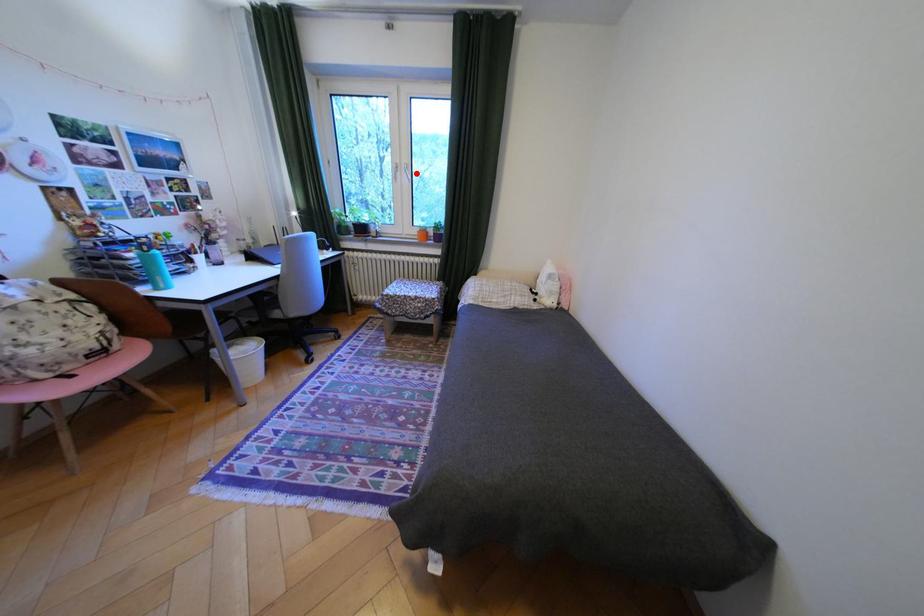
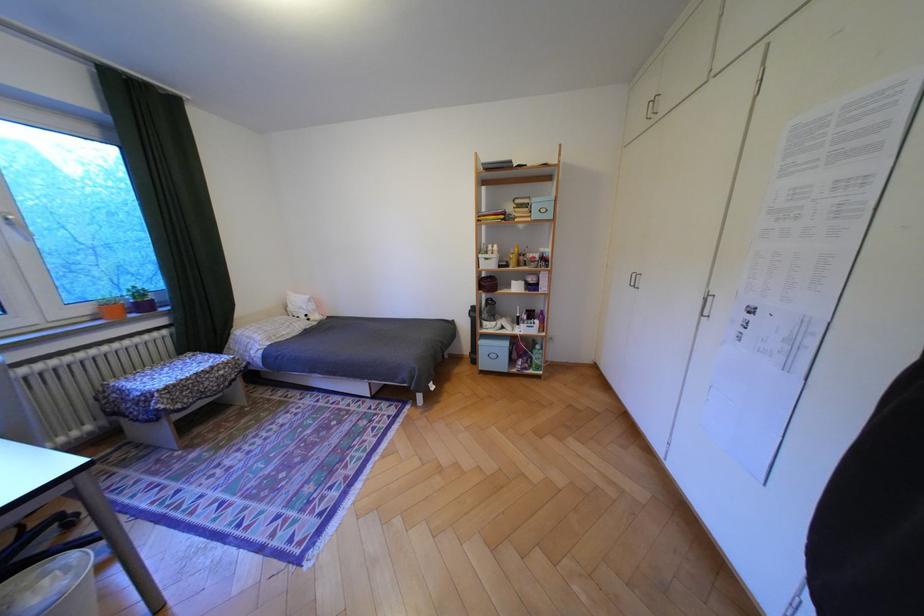
Question: I am providing you with two images of the same scene from different viewpoints. Image1 has a red point marked. In image2, the corresponding 3D location appears at what relative position? Reply with the corresponding letter.

Choices:
 (A) Closer
 (B) Farther

Answer: (B)